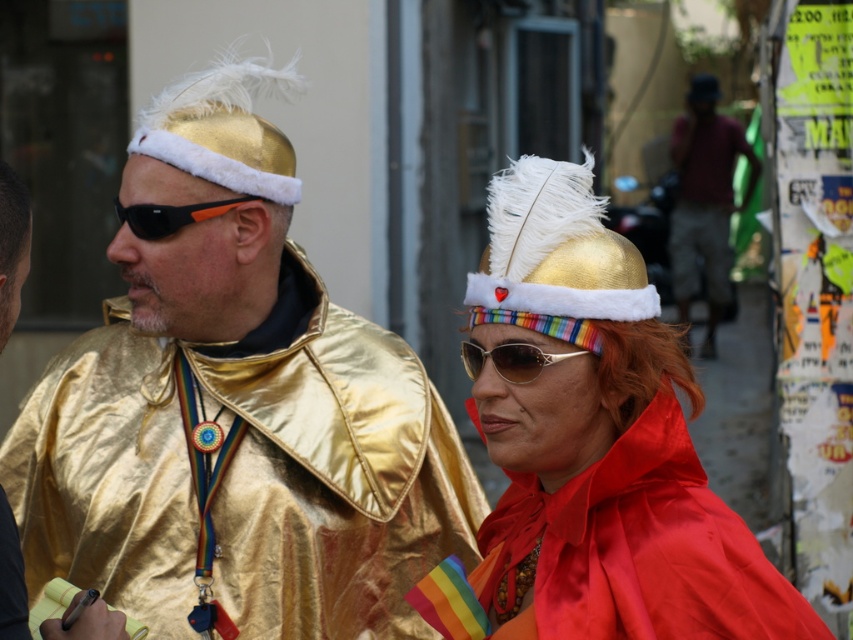
Question: Which object appears closest to the camera in this image?

Choices:
 (A) metallic gold cape at left
 (B) shiny gold headdress at center
 (C) metallic gold cape at center

Answer: (C)

Question: Is metallic gold cape at center bigger than matte black goggles at left?

Choices:
 (A) no
 (B) yes

Answer: (B)

Question: Which object is positioned farthest from the shiny gold sunglasses at center?

Choices:
 (A) matte black goggles at left
 (B) matte red shirt at center
 (C) shiny gold headdress at center
 (D) metallic gold cape at left

Answer: (B)

Question: Does shiny gold headdress at center appear over matte red shirt at center?

Choices:
 (A) no
 (B) yes

Answer: (A)

Question: Is matte red shirt at center behind shiny gold sunglasses at center?

Choices:
 (A) no
 (B) yes

Answer: (B)

Question: Considering the real-world distances, which object is closest to the matte black goggles at left?

Choices:
 (A) shiny gold headdress at center
 (B) shiny gold sunglasses at center
 (C) metallic gold cape at center
 (D) metallic gold cape at left

Answer: (D)